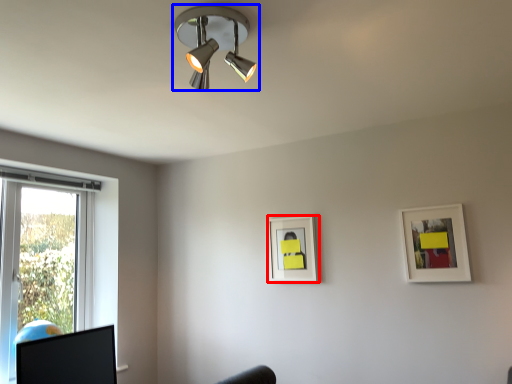
Question: Which point is further to the camera, picture frame (highlighted by a red box) or lamp (highlighted by a blue box)?

Choices:
 (A) picture frame
 (B) lamp

Answer: (A)